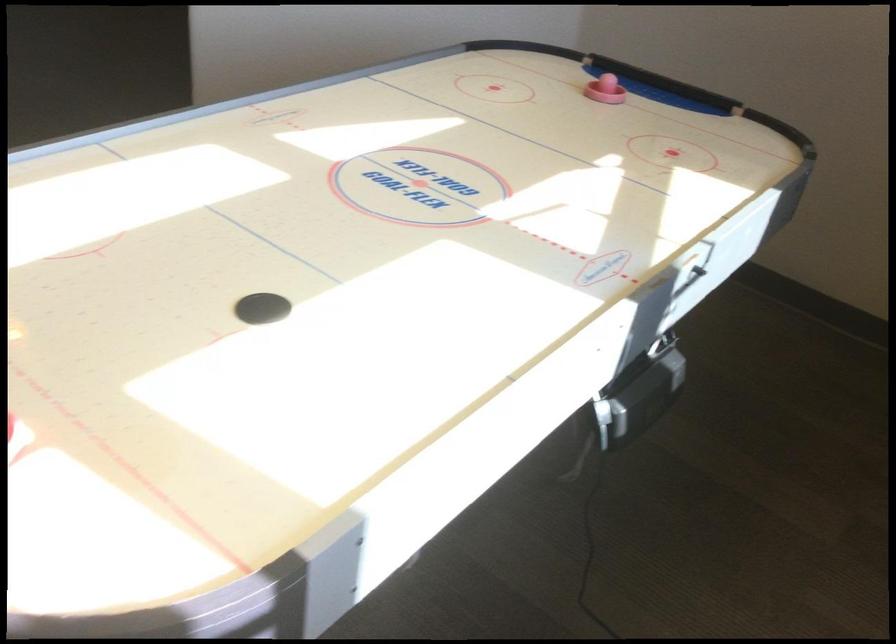
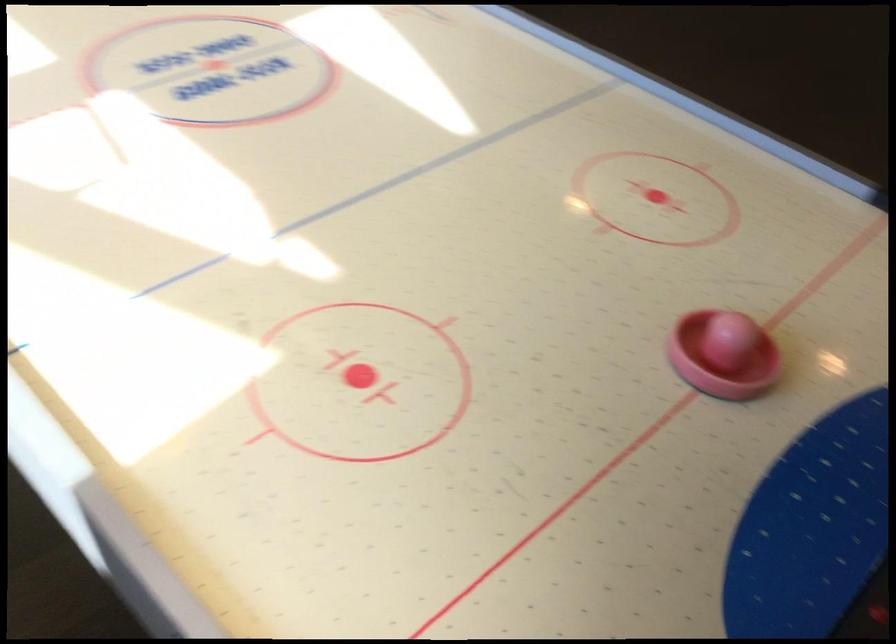
The point at (x=600, y=88) is marked in the first image. Where is the corresponding point in the second image?

(722, 355)